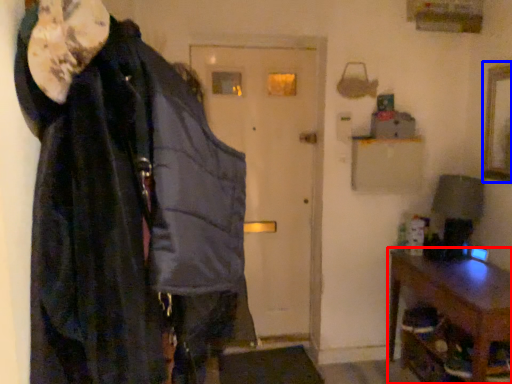
Question: Among these objects, which one is farthest to the camera, furniture (highlighted by a red box) or picture frame (highlighted by a blue box)?

Choices:
 (A) furniture
 (B) picture frame

Answer: (B)